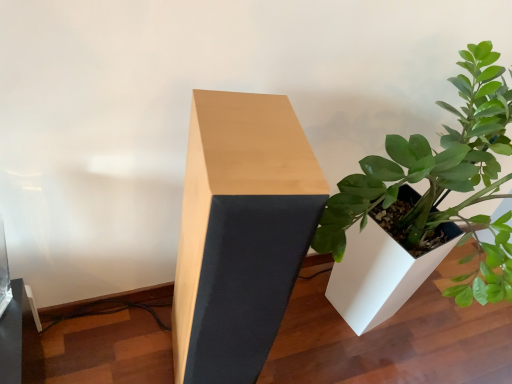
Question: Relative to light wood/black fabric table at center, is white matte planter at right in front or behind?

Choices:
 (A) behind
 (B) front

Answer: (B)

Question: Considering the positions of point (474, 195) and point (199, 342), is point (474, 195) closer or farther from the camera than point (199, 342)?

Choices:
 (A) farther
 (B) closer

Answer: (A)

Question: From a real-world perspective, is white matte planter at right above or below light wood/black fabric table at center?

Choices:
 (A) below
 (B) above

Answer: (B)

Question: Is light wood/black fabric table at center wider or thinner than white matte planter at right?

Choices:
 (A) thin
 (B) wide

Answer: (A)

Question: Visually, is light wood/black fabric table at center positioned to the left or to the right of white matte planter at right?

Choices:
 (A) right
 (B) left

Answer: (B)

Question: Relative to white matte planter at right, is light wood/black fabric table at center in front or behind?

Choices:
 (A) front
 (B) behind

Answer: (B)

Question: Is point (208, 359) positioned closer to the camera than point (352, 241)?

Choices:
 (A) closer
 (B) farther

Answer: (A)